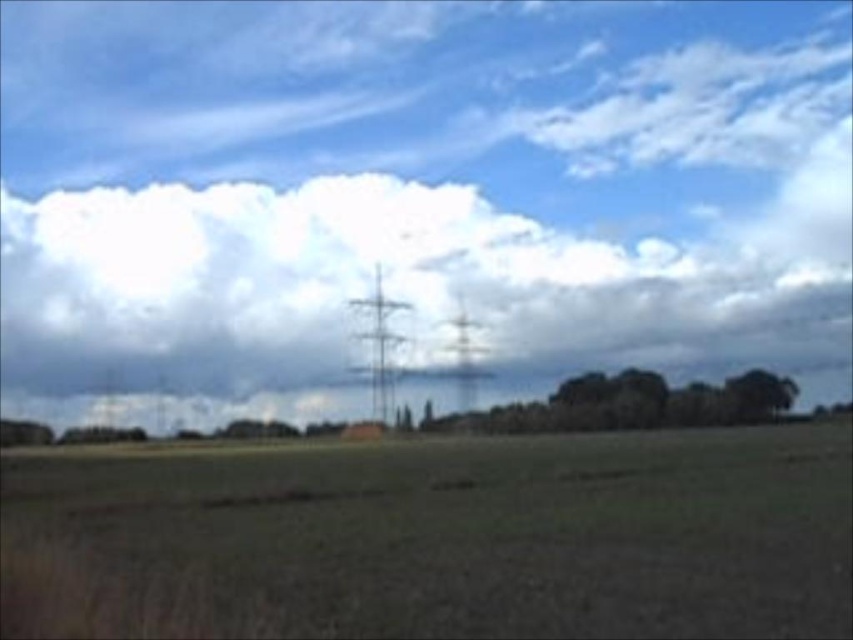
You are a landscape photographer planning to capture the rural scene. You want to highlight the contrast between the industrial elements and the natural elements. Which object from the scene would you focus on to emphasize the smaller scale of the green leafy tree at lower right compared to the green leafy trees at center?

To emphasize the smaller scale of the green leafy tree at lower right compared to the green leafy trees at center, you should focus on the green leafy trees at center since they are larger in size than the green leafy tree at lower right.

You are an airplane pilot flying at an altitude of 3000 meters. Your plane is currently above the rural landscape described. According to the image, where would you expect to see the white fluffy cloud at upper center from your cockpit window?

The white fluffy cloud at upper center is located at the coordinates (405, 285) in the image, so you would see it at the upper center portion of the landscape from your cockpit window.